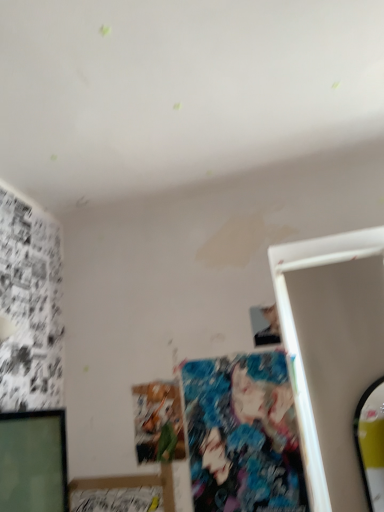
Question: Is matte paper poster at center, which is counted as the 1th art, starting from the left, behind colorful fabric poster at center, acting as the second art starting from the left?

Choices:
 (A) no
 (B) yes

Answer: (B)

Question: From the image's perspective, is matte paper poster at center, which is counted as the 1th art, starting from the left, on top of colorful fabric poster at center, acting as the 1th art starting from the right?

Choices:
 (A) no
 (B) yes

Answer: (A)

Question: Is the surface of matte paper poster at center, positioned as the 2th art in right-to-left order, in direct contact with colorful fabric poster at center, acting as the 1th art starting from the right?

Choices:
 (A) no
 (B) yes

Answer: (A)

Question: Does matte paper poster at center, positioned as the 2th art in right-to-left order, have a greater width compared to colorful fabric poster at center, acting as the second art starting from the left?

Choices:
 (A) no
 (B) yes

Answer: (B)

Question: Is matte paper poster at center, which is counted as the 1th art, starting from the left, smaller than colorful fabric poster at center, acting as the 1th art starting from the right?

Choices:
 (A) yes
 (B) no

Answer: (A)

Question: In the image, is colorful fabric poster at center, acting as the 1th art starting from the right, positioned in front of or behind matte paper poster at center, which is counted as the 1th art, starting from the left?

Choices:
 (A) behind
 (B) front

Answer: (B)

Question: Considering the positions of point (235, 490) and point (170, 401), is point (235, 490) closer or farther from the camera than point (170, 401)?

Choices:
 (A) farther
 (B) closer

Answer: (B)

Question: Is colorful fabric poster at center, acting as the 1th art starting from the right, to the left or to the right of matte paper poster at center, positioned as the 2th art in right-to-left order, in the image?

Choices:
 (A) right
 (B) left

Answer: (A)

Question: Is colorful fabric poster at center, acting as the 1th art starting from the right, taller or shorter than matte paper poster at center, positioned as the 2th art in right-to-left order?

Choices:
 (A) tall
 (B) short

Answer: (A)

Question: Based on their sizes in the image, would you say smooth black phone at upper right is bigger or smaller than colorful fabric poster at center, acting as the 1th art starting from the right?

Choices:
 (A) big
 (B) small

Answer: (B)

Question: Relative to colorful fabric poster at center, acting as the second art starting from the left, is smooth black phone at upper right in front or behind?

Choices:
 (A) behind
 (B) front

Answer: (A)

Question: Is smooth black phone at upper right inside the boundaries of colorful fabric poster at center, acting as the 1th art starting from the right, or outside?

Choices:
 (A) inside
 (B) outside

Answer: (B)

Question: From the image's perspective, is smooth black phone at upper right located above or below colorful fabric poster at center, acting as the second art starting from the left?

Choices:
 (A) above
 (B) below

Answer: (A)

Question: From a real-world perspective, relative to colorful fabric poster at center, acting as the 1th art starting from the right, is matte paper poster at center, which is counted as the 1th art, starting from the left, vertically above or below?

Choices:
 (A) below
 (B) above

Answer: (B)

Question: Considering their positions, is matte paper poster at center, positioned as the 2th art in right-to-left order, located in front of or behind colorful fabric poster at center, acting as the 1th art starting from the right?

Choices:
 (A) behind
 (B) front

Answer: (A)